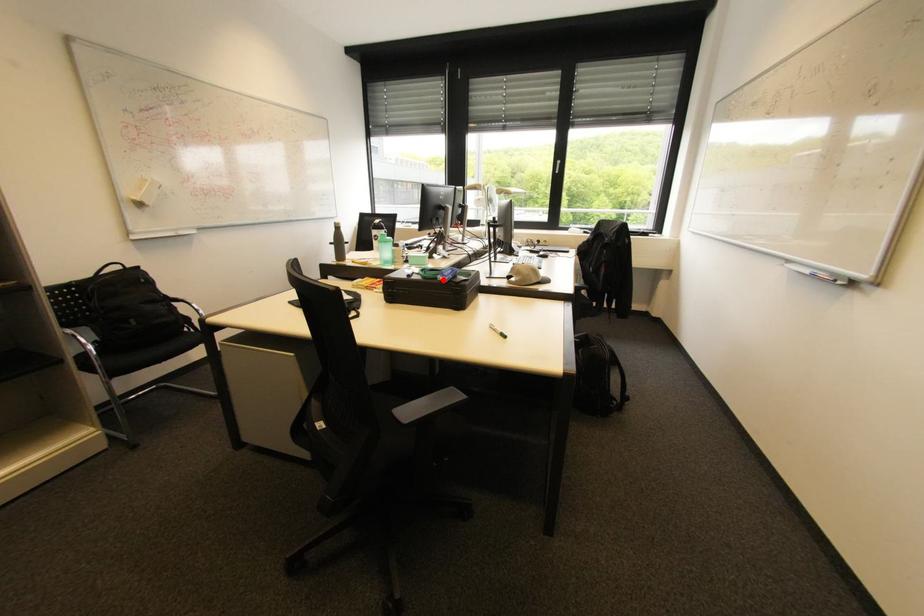
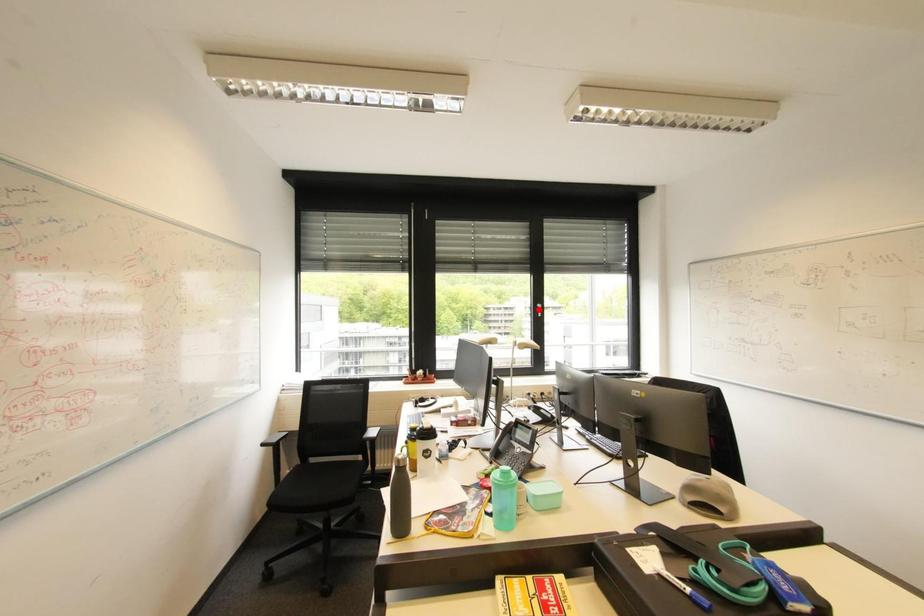
I am providing you with two images of the same scene from different viewpoints. A red point is marked on the first image and another point is marked on the second image. Do the highlighted points in image1 and image2 indicate the same real-world spot?

No